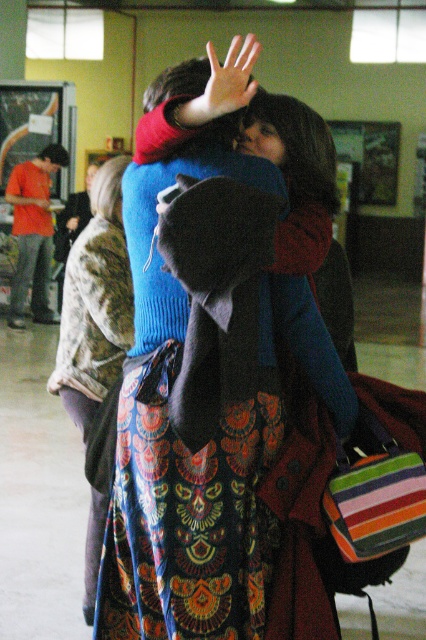
The height and width of the screenshot is (640, 426). Describe the element at coordinates (94, 304) in the screenshot. I see `floral dress at center` at that location.

Can you confirm if floral dress at center is positioned below smooth skin hand at center?

Correct, floral dress at center is located below smooth skin hand at center.

Identify the location of floral dress at center. (94, 304).

Can you confirm if matte blue sweater at center is smaller than smooth skin hand at center?

Yes.

Is matte blue sweater at center bigger than smooth skin hand at center?

Incorrect, matte blue sweater at center is not larger than smooth skin hand at center.

Locate an element on the screen. The height and width of the screenshot is (640, 426). matte blue sweater at center is located at coordinates (212, 412).

Does matte blue sweater at center have a lesser width compared to floral dress at center?

No, matte blue sweater at center is not thinner than floral dress at center.

Who is lower down, matte blue sweater at center or floral dress at center?

floral dress at center is below.

Is point (203, 72) positioned after point (78, 282)?

No, it is in front of (78, 282).

Where is `matte blue sweater at center`? This screenshot has height=640, width=426. matte blue sweater at center is located at coordinates (212, 412).